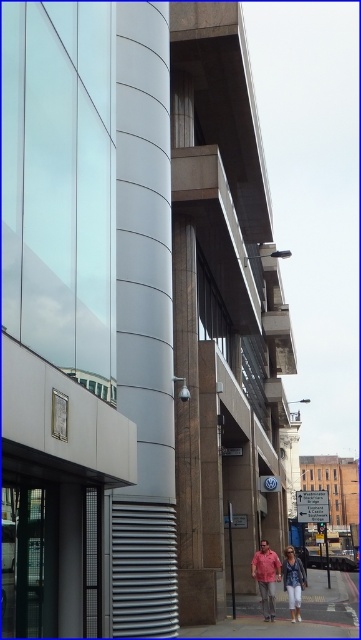
Question: Is concrete sidewalk at lower center wider than matte pink shirt at lower center?

Choices:
 (A) no
 (B) yes

Answer: (B)

Question: Which point is farther to the camera?

Choices:
 (A) (258, 614)
 (B) (289, 554)
 (C) (266, 541)

Answer: (C)

Question: Is the position of concrete sidewalk at lower center less distant than that of denim jacket at lower center?

Choices:
 (A) no
 (B) yes

Answer: (B)

Question: In this image, where is concrete sidewalk at lower center located relative to denim jacket at lower center?

Choices:
 (A) below
 (B) above

Answer: (A)

Question: Which of the following is the closest to the observer?

Choices:
 (A) (275, 605)
 (B) (293, 589)

Answer: (B)

Question: Which object is farther from the camera taking this photo?

Choices:
 (A) matte pink shirt at lower center
 (B) concrete sidewalk at lower center

Answer: (A)